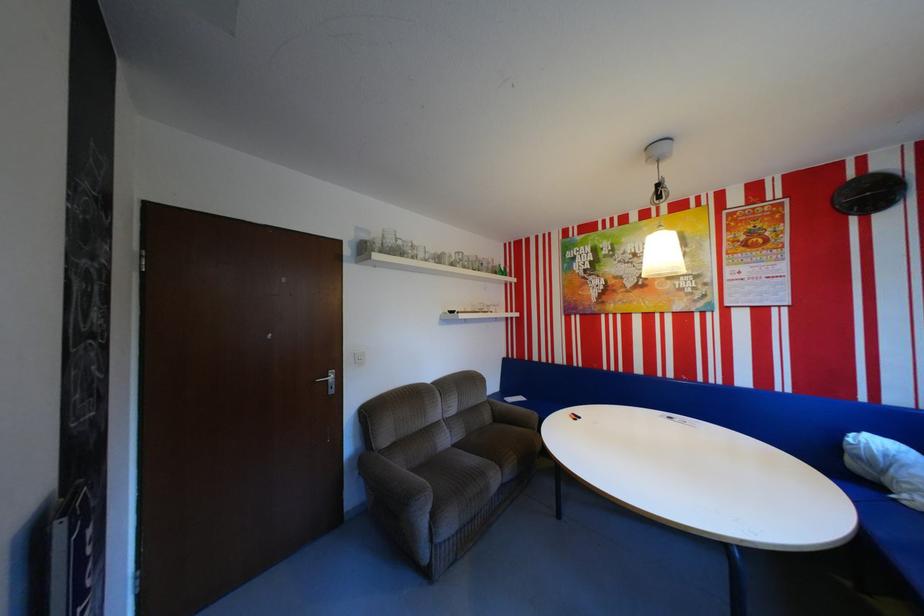
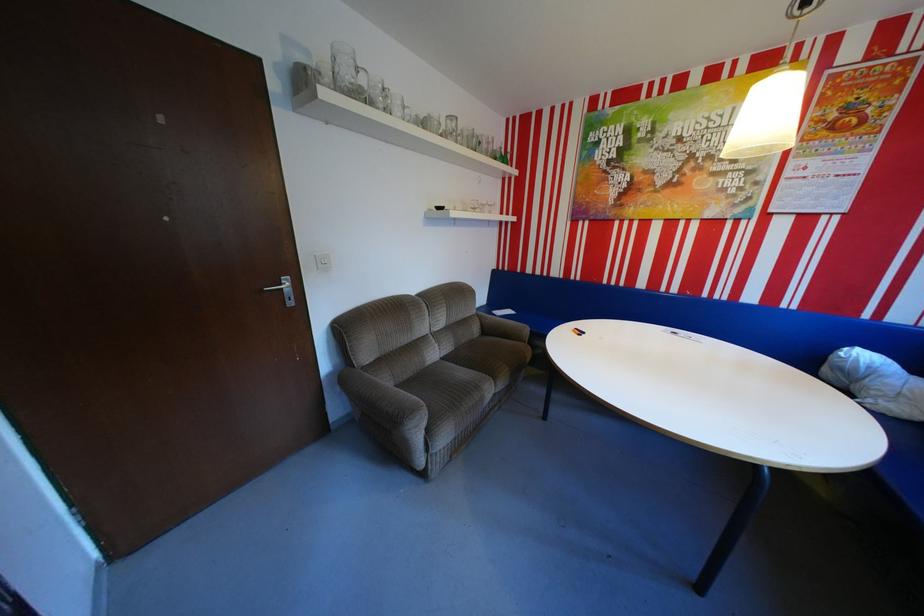
Where in the second image is the point corresponding to [471,432] from the first image?

(459, 346)